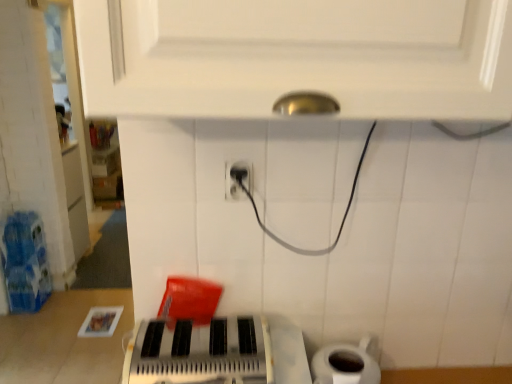
Question: Is white matte toilet paper at lower right shorter than black plastic power plug at center?

Choices:
 (A) no
 (B) yes

Answer: (A)

Question: Does white matte toilet paper at lower right have a lesser width compared to black plastic power plug at center?

Choices:
 (A) no
 (B) yes

Answer: (A)

Question: Is white matte toilet paper at lower right positioned behind black plastic power plug at center?

Choices:
 (A) yes
 (B) no

Answer: (A)

Question: From a real-world perspective, is white matte toilet paper at lower right located higher than black plastic power plug at center?

Choices:
 (A) yes
 (B) no

Answer: (B)

Question: From the image's perspective, is white matte toilet paper at lower right located above black plastic power plug at center?

Choices:
 (A) yes
 (B) no

Answer: (B)

Question: Are white matte toilet paper at lower right and black plastic power plug at center beside each other?

Choices:
 (A) no
 (B) yes

Answer: (A)

Question: Considering the relative sizes of white matte toilet paper at lower right and metallic silver keyboard at center in the image provided, is white matte toilet paper at lower right smaller than metallic silver keyboard at center?

Choices:
 (A) no
 (B) yes

Answer: (B)

Question: Is white matte toilet paper at lower right outside metallic silver keyboard at center?

Choices:
 (A) yes
 (B) no

Answer: (A)

Question: Is white matte toilet paper at lower right oriented towards metallic silver keyboard at center?

Choices:
 (A) yes
 (B) no

Answer: (B)

Question: From a real-world perspective, is white matte toilet paper at lower right physically above metallic silver keyboard at center?

Choices:
 (A) no
 (B) yes

Answer: (A)

Question: From the image's perspective, does white matte toilet paper at lower right appear lower than metallic silver keyboard at center?

Choices:
 (A) no
 (B) yes

Answer: (B)

Question: Are white matte toilet paper at lower right and metallic silver keyboard at center located far from each other?

Choices:
 (A) no
 (B) yes

Answer: (A)

Question: Does metallic silver keyboard at center have a greater height compared to black plastic power plug at center?

Choices:
 (A) yes
 (B) no

Answer: (A)